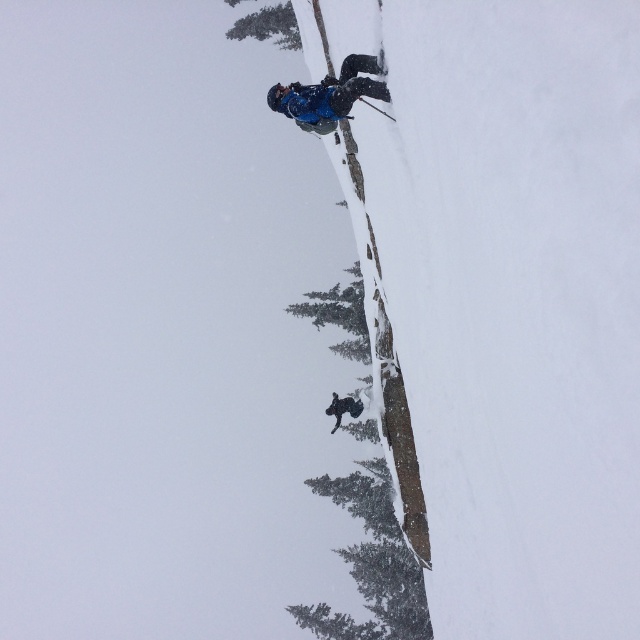
You are standing at the camera position and want to reach the point marked as point (292, 116). If you walk straight towards it, will you have to climb uphill or downhill?

The point marked as point (292, 116) is 16.70 meters away from the camera position. Since the skier is descending a steep slope, the direction from the camera to the point would likely involve going downhill.

You are standing at the starting point of the ski slope and want to reach the finish line. The starting point is marked by point (x=324, y=99) and the finish line is marked by point (x=352, y=406). Which direction should you ski to reach the finish line?

Point (x=324, y=99) is closer to the viewer than point (x=352, y=406), so you should ski away from your current position towards the finish line marked by point (x=352, y=406).

From the picture: You are standing at the camera position and want to throw a snowball to the matte blue jacket at center. If your maximum throwing distance is 100 feet, will you be able to reach them?

The matte blue jacket at center is 117.07 feet from the camera, which exceeds your maximum throwing distance of 100 feet. Therefore, you will not be able to reach them with a snowball.